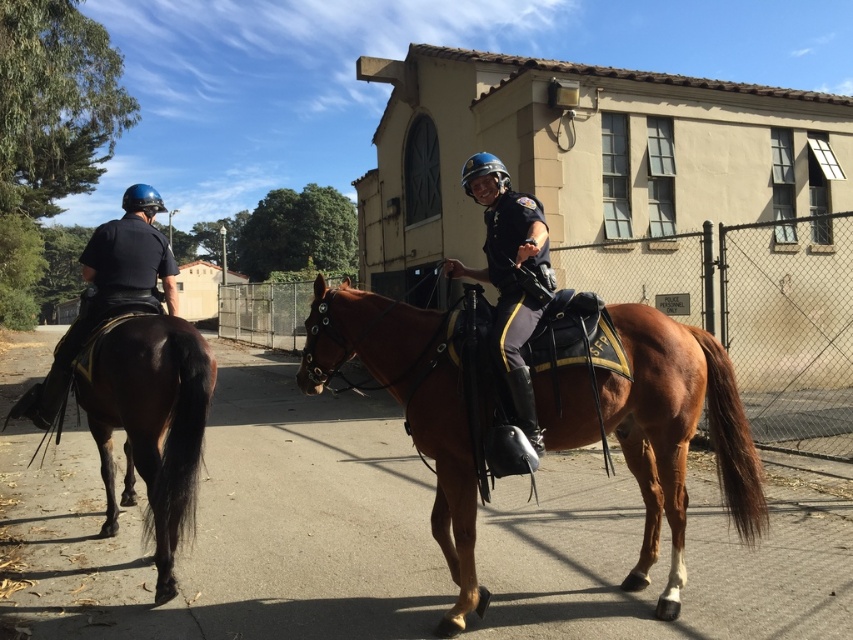
Between brown leather saddle at center and black matte uniform at left, which one has more height?

black matte uniform at left

This screenshot has width=853, height=640. Describe the element at coordinates (676, 433) in the screenshot. I see `brown leather saddle at center` at that location.

Image resolution: width=853 pixels, height=640 pixels. I want to click on brown leather saddle at center, so click(x=676, y=433).

Based on the photo, can you confirm if brown leather saddle at center is positioned below brown glossy horse at left?

Yes.

Which of these two, brown leather saddle at center or brown glossy horse at left, stands shorter?

Standing shorter between the two is brown glossy horse at left.

Identify the location of brown leather saddle at center. The width and height of the screenshot is (853, 640). (676, 433).

The width and height of the screenshot is (853, 640). I want to click on brown leather saddle at center, so pos(676,433).

Is shiny black helmet at center positioned in front of black matte uniform at left?

That is True.

Who is positioned more to the right, shiny black helmet at center or black matte uniform at left?

Positioned to the right is shiny black helmet at center.

You are a GUI agent. You are given a task and a screenshot of the screen. Output one action in this format:
    pyautogui.click(x=<x>, y=<y>)
    Task: Click on the shiny black helmet at center
    The image size is (853, 640).
    Given the screenshot: What is the action you would take?
    pyautogui.click(x=509, y=275)